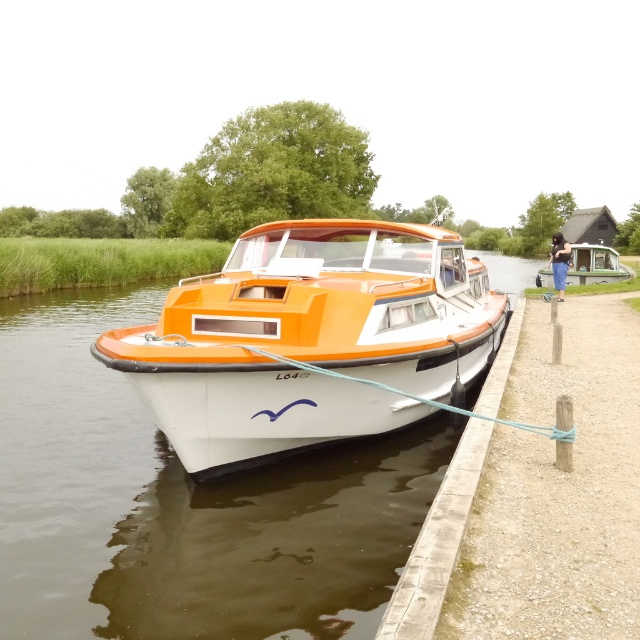
You are a boat operator who needs to move the orange matte boat at center and the green matte boat at right. The minimum safe distance between boats during maneuvering is 20 meters. Based on the current spacing, can you move them safely without violating the safety rule?

The orange matte boat at center and green matte boat at right are currently 16.82 meters apart, which is less than the required 20 meters for safe maneuvering. Therefore, you cannot move them safely without violating the safety rule.

You are a photographer planning to take a photo of the orange matte boat at center and the green matte boat at right. Which boat should you focus on if you want to capture the one that is more to the left?

The orange matte boat at center is positioned on the left side of the green matte boat at right, so you should focus on the orange matte boat at center to capture the one more to the left.

You are standing on the dockside and see two points marked on the water surface. The first point is at coordinates point (372, 269) and the second is at point (612, 273). Which point is closer to you from your current position on the dockside?

Point (372, 269) is in front of point (612, 273), so it is closer to you.